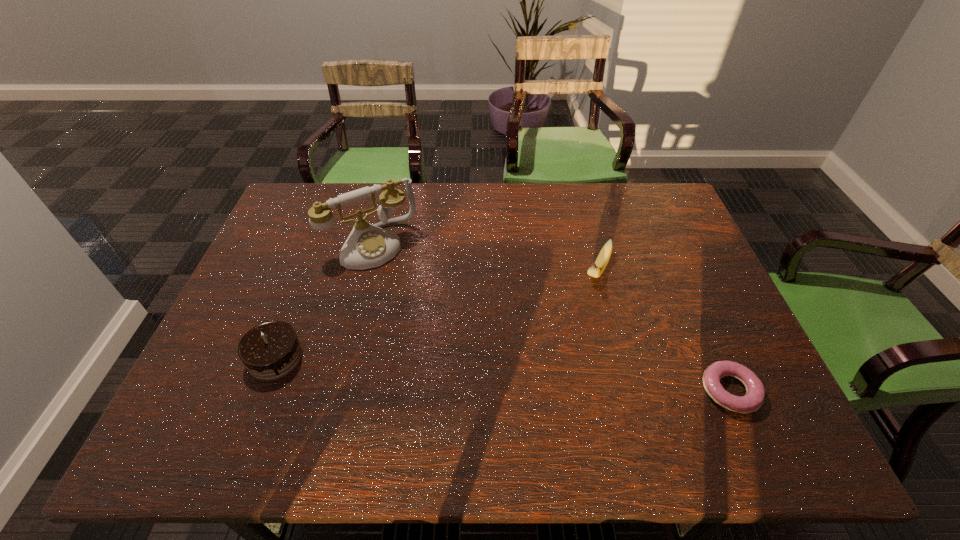
I want to click on chocolate cake, so tap(271, 350).

Locate an element on the screen. The image size is (960, 540). the rightmost object is located at coordinates (755, 392).

Find the location of a particular element. The width and height of the screenshot is (960, 540). the shortest object is located at coordinates click(x=755, y=392).

This screenshot has width=960, height=540. In order to click on the tallest object in this screenshot , I will do `click(368, 246)`.

The width and height of the screenshot is (960, 540). I want to click on banana, so click(596, 269).

Where is `vacant space located 0.170m on the back of the chocolate cake`? The width and height of the screenshot is (960, 540). vacant space located 0.170m on the back of the chocolate cake is located at coordinates (302, 286).

Locate an element on the screen. The image size is (960, 540). vacant region located on the left of the rightmost object is located at coordinates (587, 391).

Find the location of a particular element. blank space located 0.150m on the dial of the telephone is located at coordinates (413, 300).

You are a GUI agent. You are given a task and a screenshot of the screen. Output one action in this format:
    pyautogui.click(x=<x>, y=<y>)
    Task: Click on the blank area located 0.320m on the dial of the telephone
    
    Given the screenshot: What is the action you would take?
    pyautogui.click(x=442, y=345)

At what (x,y) coordinates should I click in order to perform the action: click on vacant region located on the dial of the telephone. Please return your answer as a coordinate pair (x, y). Looking at the image, I should click on (397, 277).